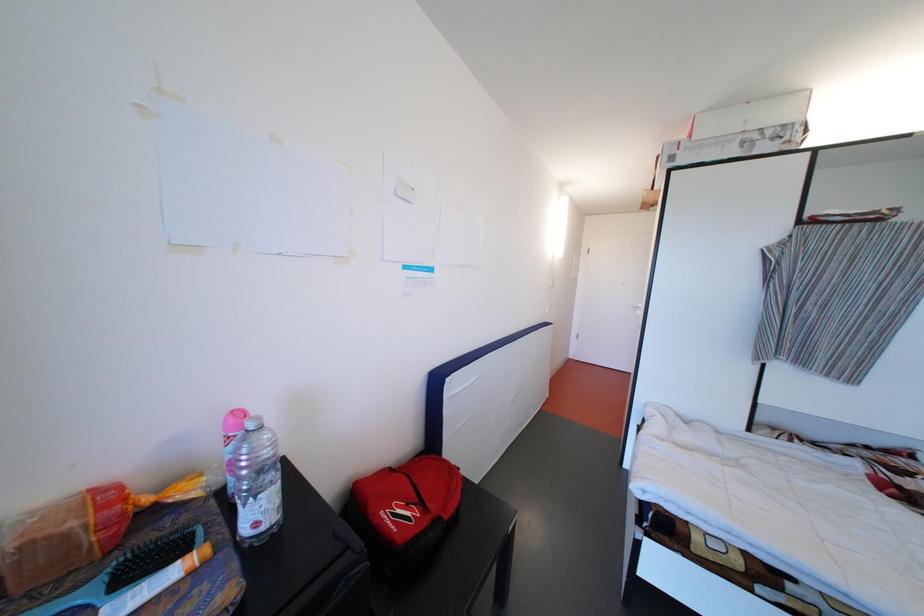
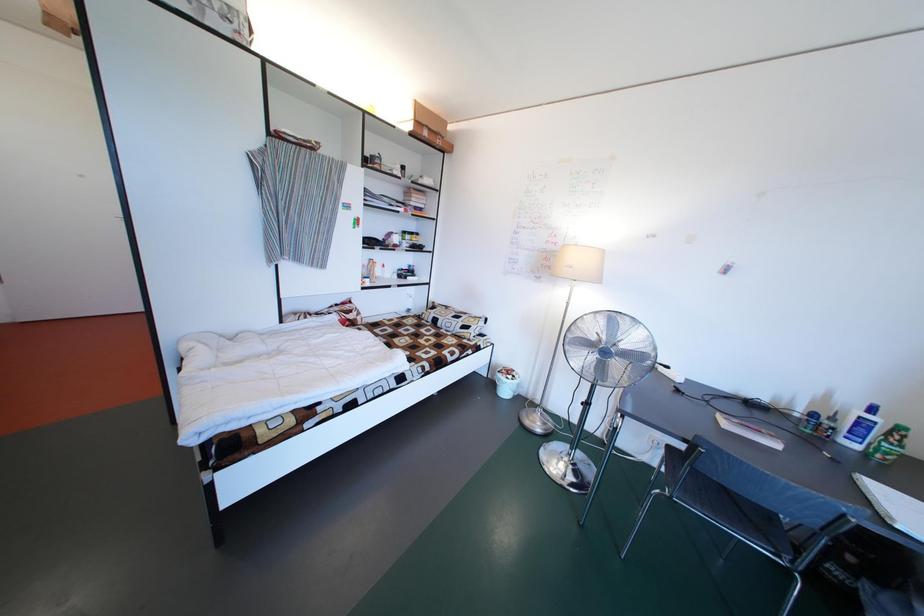
The first image is from the beginning of the video and the second image is from the end. How did the camera likely rotate when shooting the video?

The camera rotated toward right-down.